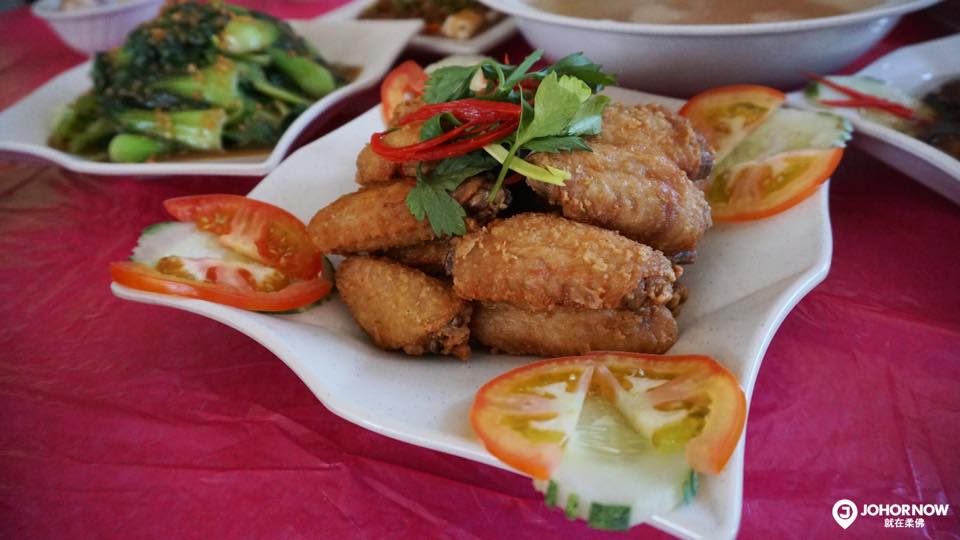
Where is `plate`? The height and width of the screenshot is (540, 960). plate is located at coordinates (415, 420).